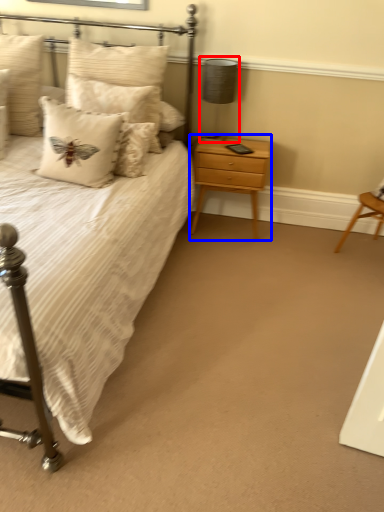
Question: Which object is further to the camera taking this photo, table lamp (highlighted by a red box) or nightstand (highlighted by a blue box)?

Choices:
 (A) table lamp
 (B) nightstand

Answer: (B)